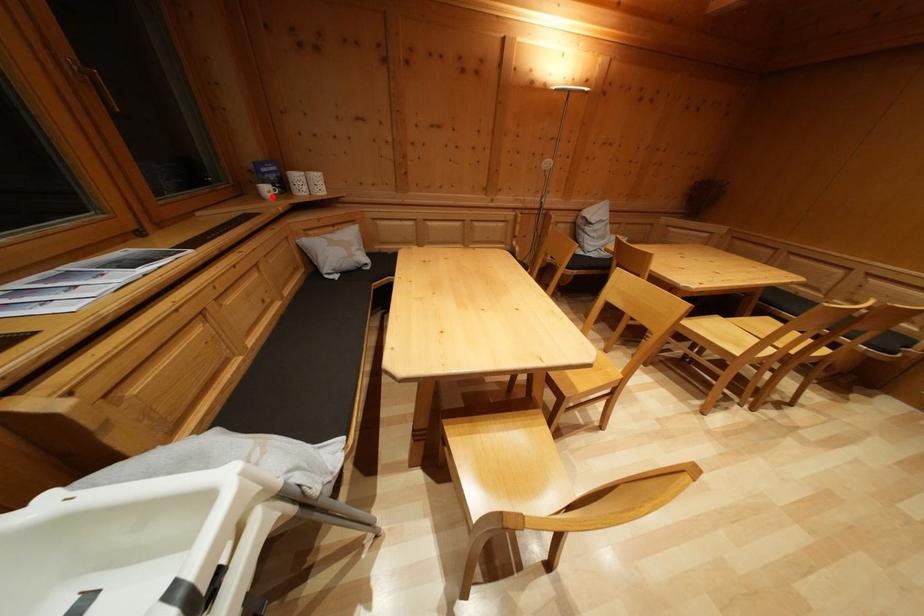
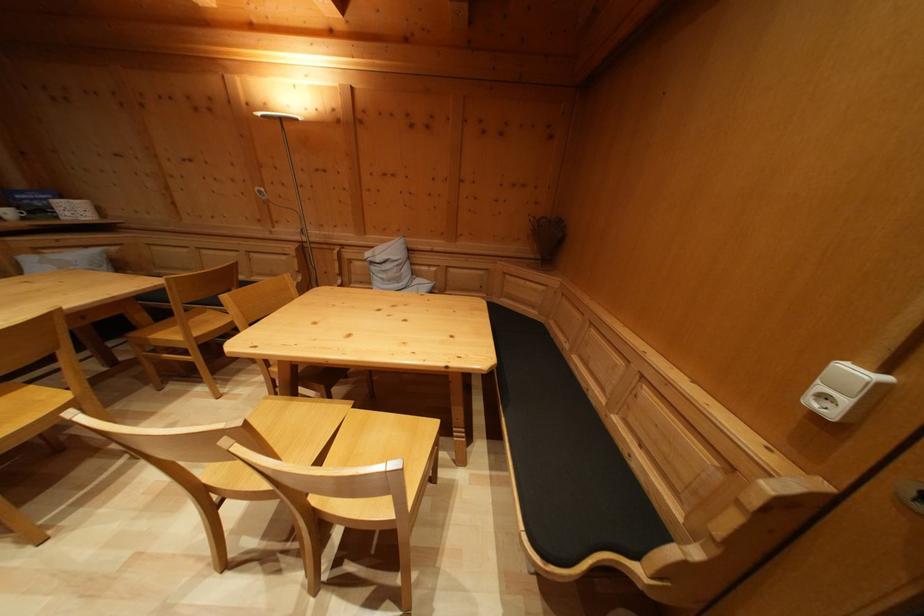
Question: A red point is marked in image1. In image2, is the corresponding 3D point closer to the camera or farther? Reply with the corresponding letter.

Choices:
 (A) The corresponding 3D point is closer.
 (B) The corresponding 3D point is farther.

Answer: (B)